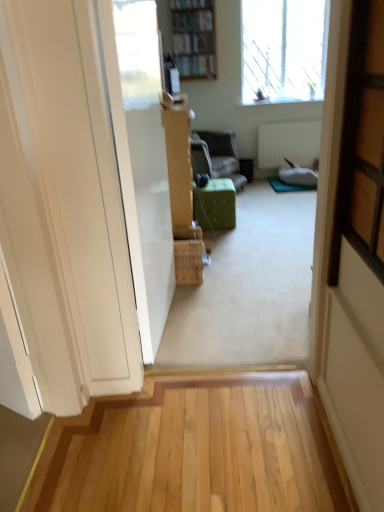
Question: In terms of size, does transparent glass window at upper right appear bigger or smaller than green fabric ottoman at center, the 2th furniture from the top?

Choices:
 (A) big
 (B) small

Answer: (A)

Question: Based on their positions, is transparent glass window at upper right located to the left or right of green fabric ottoman at center, the second furniture from the back?

Choices:
 (A) left
 (B) right

Answer: (B)

Question: Considering the real-world distances, which object is closest to the green fabric ottoman at center, which is the 1th furniture from top to bottom?

Choices:
 (A) wooden bookshelf at upper center
 (B) green fabric ottoman at center, the first furniture in the front-to-back sequence
 (C) transparent glass window at upper right

Answer: (A)

Question: Based on their relative distances, which object is farther from the transparent glass window at upper right?

Choices:
 (A) wooden bookshelf at upper center
 (B) green fabric ottoman at center, the 2th furniture from the top
 (C) green fabric ottoman at center, acting as the second furniture starting from the bottom

Answer: (B)